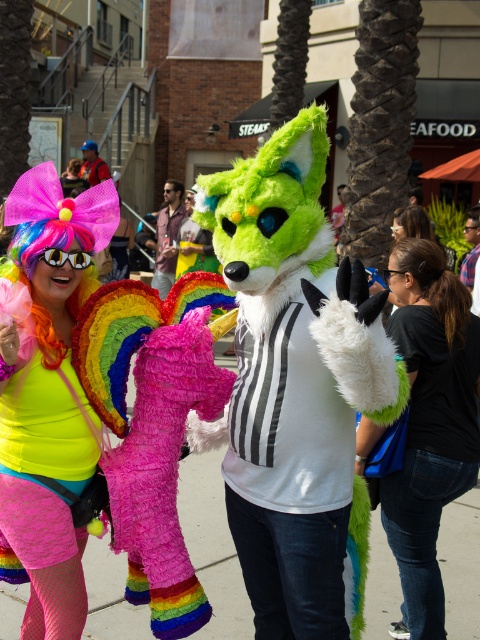
Find the location of `neon matte wig at upper left`. neon matte wig at upper left is located at coordinates (48, 401).

Which is more to the left, neon matte wig at upper left or pavement at center?

neon matte wig at upper left

Between point (17, 256) and point (213, 486), which one is positioned behind?

The point (213, 486) is behind.

Where is `neon matte wig at upper left`? The image size is (480, 640). neon matte wig at upper left is located at coordinates (48, 401).

Which is more to the left, black hair at center or matte yellow goggles at center?

matte yellow goggles at center is more to the left.

Does black hair at center have a lesser height compared to matte yellow goggles at center?

In fact, black hair at center may be taller than matte yellow goggles at center.

Where is `black hair at center`? black hair at center is located at coordinates (434, 282).

Is black cotton t-shirt at center further to camera compared to black hair at center?

That is False.

Is black cotton t-shirt at center positioned before black hair at center?

Yes, black cotton t-shirt at center is closer to the viewer.

Between point (457, 305) and point (428, 292), which one is positioned in front?

Point (457, 305) is in front.

This screenshot has width=480, height=640. I want to click on black cotton t-shirt at center, so click(x=430, y=424).